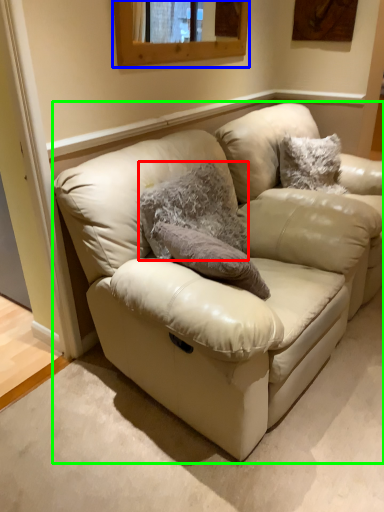
Question: Which object is the closest to the animal (highlighted by a red box)? Choose among these: window (highlighted by a blue box) or studio couch (highlighted by a green box).

Choices:
 (A) window
 (B) studio couch

Answer: (B)